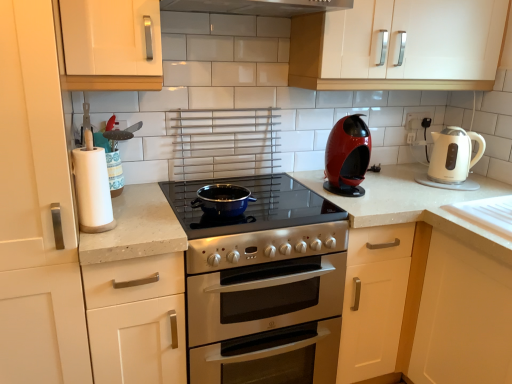
At what (x,y) coordinates should I click in order to perform the action: click on vacant space underneath blue enameled wok at center (from a real-world perspective). Please return your answer as a coordinate pair (x, y). Looking at the image, I should click on point(220,208).